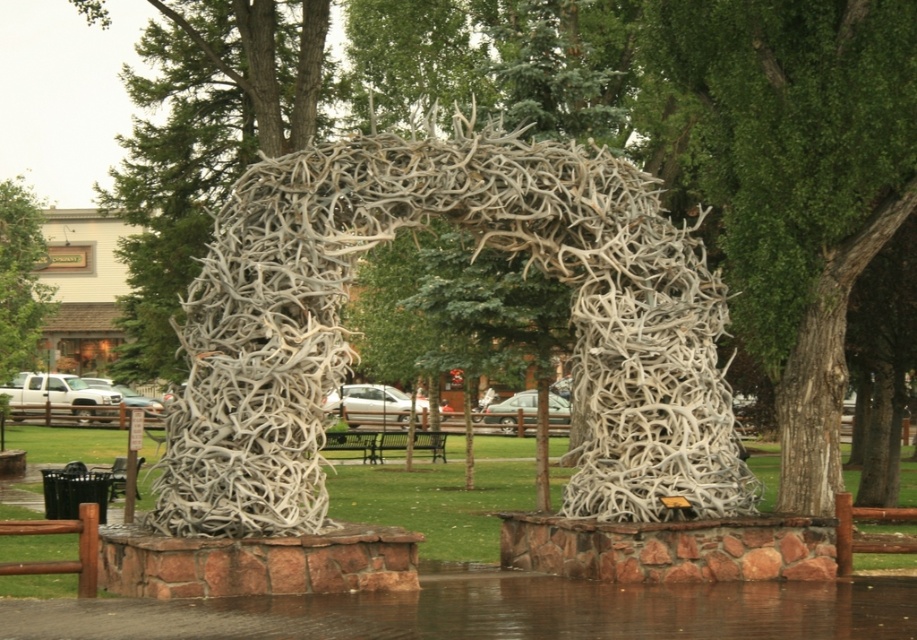
Question: Does white antler arch at center have a larger size compared to green leafy tree at upper left?

Choices:
 (A) yes
 (B) no

Answer: (B)

Question: Among these points, which one is nearest to the camera?

Choices:
 (A) (623, 182)
 (B) (742, 51)
 (C) (23, 186)

Answer: (A)

Question: Which point is farther from the camera taking this photo?

Choices:
 (A) (25, 262)
 (B) (266, 460)

Answer: (A)

Question: Which object is positioned farthest from the white antler arch at center?

Choices:
 (A) green leafy tree at upper left
 (B) green leafy tree at center

Answer: (A)

Question: Where is green leafy tree at center located in relation to green leafy tree at upper left in the image?

Choices:
 (A) left
 (B) right

Answer: (B)

Question: Observing the image, what is the correct spatial positioning of green leafy tree at center in reference to green leafy tree at upper left?

Choices:
 (A) right
 (B) left

Answer: (A)